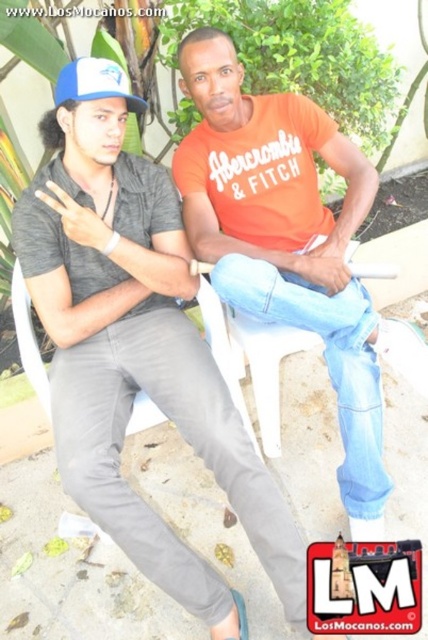
Question: Does gray cotton shirt at left lie in front of blue fabric baseball cap at upper left?

Choices:
 (A) yes
 (B) no

Answer: (A)

Question: Does gray cotton shirt at left lie in front of blue fabric baseball cap at upper left?

Choices:
 (A) no
 (B) yes

Answer: (B)

Question: Does orange cotton t-shirt at center come behind blue fabric baseball cap at upper left?

Choices:
 (A) no
 (B) yes

Answer: (B)

Question: Based on their relative distances, which object is nearer to the blue fabric baseball cap at upper left?

Choices:
 (A) gray cotton shirt at left
 (B) orange cotton t-shirt at center

Answer: (A)

Question: Which point is closer to the camera?

Choices:
 (A) (202, 244)
 (B) (103, 81)

Answer: (B)

Question: Among these objects, which one is farthest from the camera?

Choices:
 (A) gray cotton shirt at left
 (B) blue fabric baseball cap at upper left
 (C) orange cotton t-shirt at center

Answer: (C)